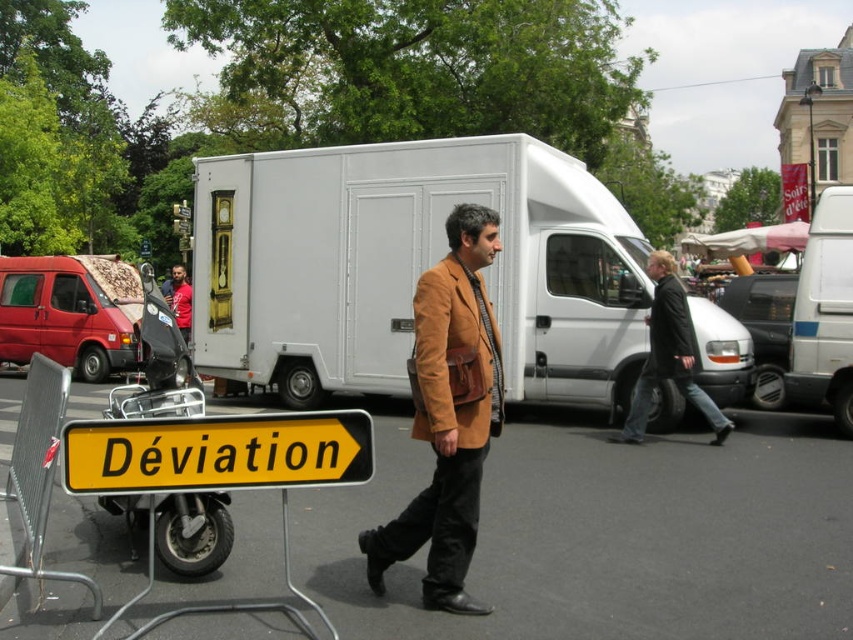
Question: Which object appears farthest from the camera in this image?

Choices:
 (A) brown suede jacket at center
 (B) dark brown leather jacket at center

Answer: (B)

Question: Among these points, which one is nearest to the camera?

Choices:
 (A) (509, 186)
 (B) (287, 433)

Answer: (B)

Question: Does suede brown jacket at center have a greater width compared to dark brown leather jacket at center?

Choices:
 (A) no
 (B) yes

Answer: (A)

Question: Is white matte truck at center thinner than dark brown leather jacket at center?

Choices:
 (A) yes
 (B) no

Answer: (A)

Question: Among these points, which one is farthest from the camera?

Choices:
 (A) (666, 285)
 (B) (163, 305)
 (C) (378, 547)
 (D) (419, 205)

Answer: (D)

Question: Can you confirm if black leather jacket at center is positioned below red fabric shirt at center?

Choices:
 (A) yes
 (B) no

Answer: (A)